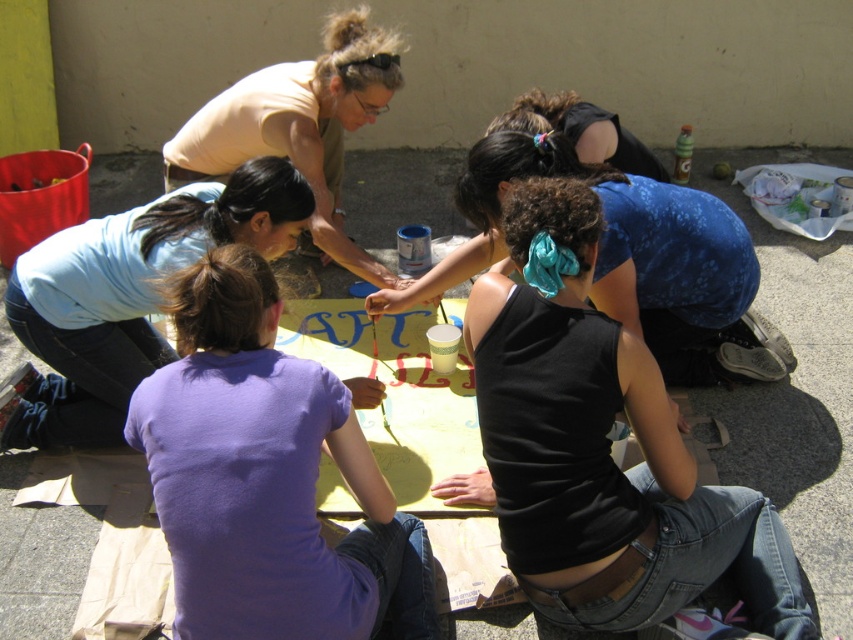
You are standing at the center of the courtyard and see the point marked at coordinates (267,477). What is the object located at this point?

The point at coordinates (267,477) marks the purple cotton shirt at center.

You are a photographer standing in the courtyard. You want to take a photo of the blue floral tank top at center without the light blue fabric at upper left blocking the view. Is this possible?

The light blue fabric at upper left is located above the blue floral tank top at center, so it is blocking the view. Move to a position where the light blue fabric at upper left is not in front of the blue floral tank top at center.